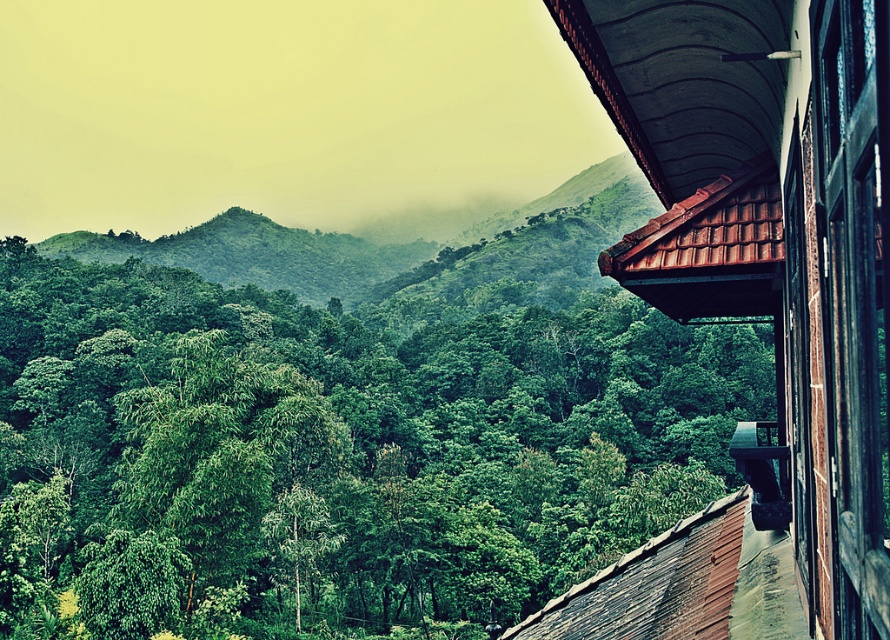
Consider the image. You are standing in the landscape scene described. You notice the green leafy trees at center and the black wood window at right. Which object appears wider in the image?

The green leafy trees at center might be wider than the black wood window at right according to the description.

You are standing in the landscape and want to look through the black wood window at right. Which direction should you turn to face the green leafy trees at center?

The green leafy trees at center are to the left of the black wood window at right. So, if you are facing the black wood window at right, you should turn to your left to face the green leafy trees at center.